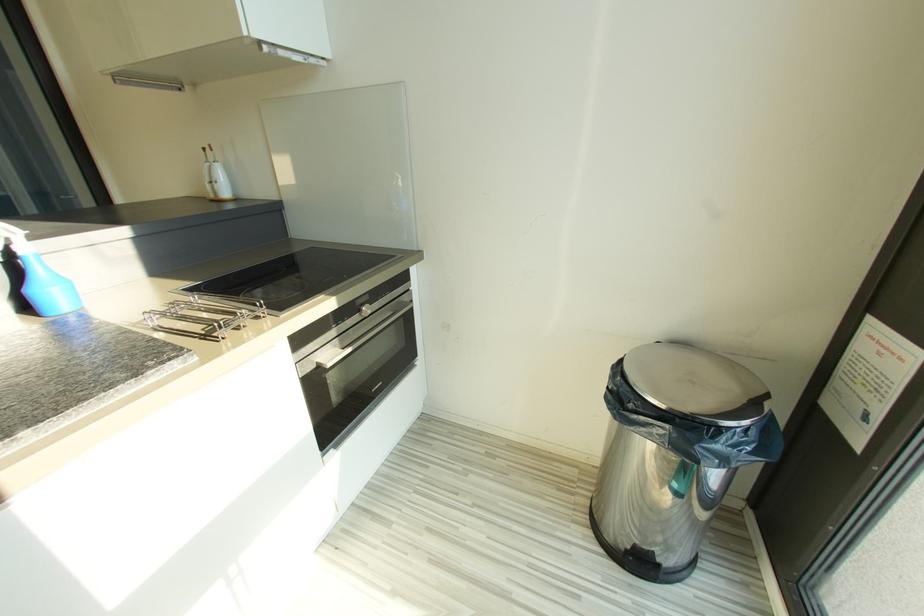
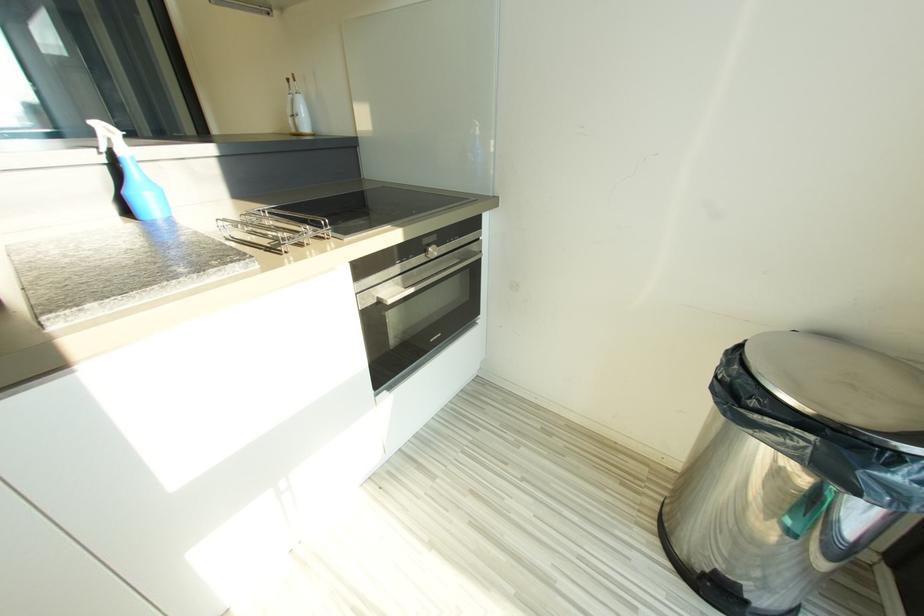
Question: Based on the continuous images, in which direction is the camera rotating? Reply with the corresponding letter.

Choices:
 (A) Left
 (B) Right
 (C) Up
 (D) Down

Answer: (A)